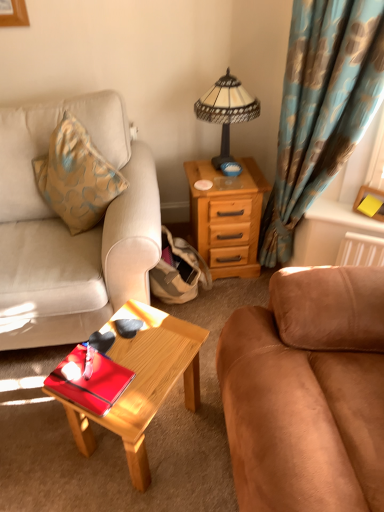
You are a GUI agent. You are given a task and a screenshot of the screen. Output one action in this format:
    pyautogui.click(x=<x>, y=<y>)
    Task: Click on the vacant region to the left of yellow matte picture frame at upper right
    
    Given the screenshot: What is the action you would take?
    pyautogui.click(x=346, y=211)